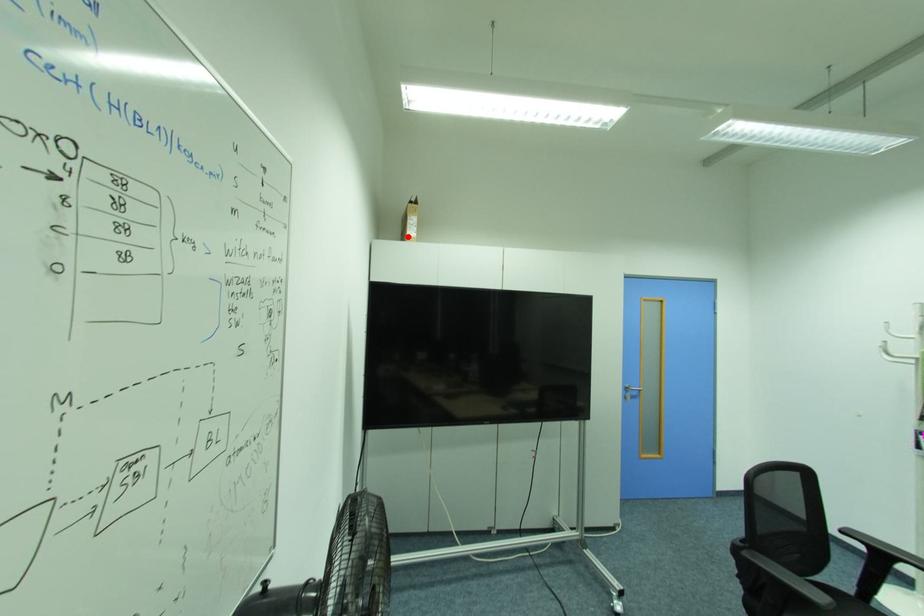
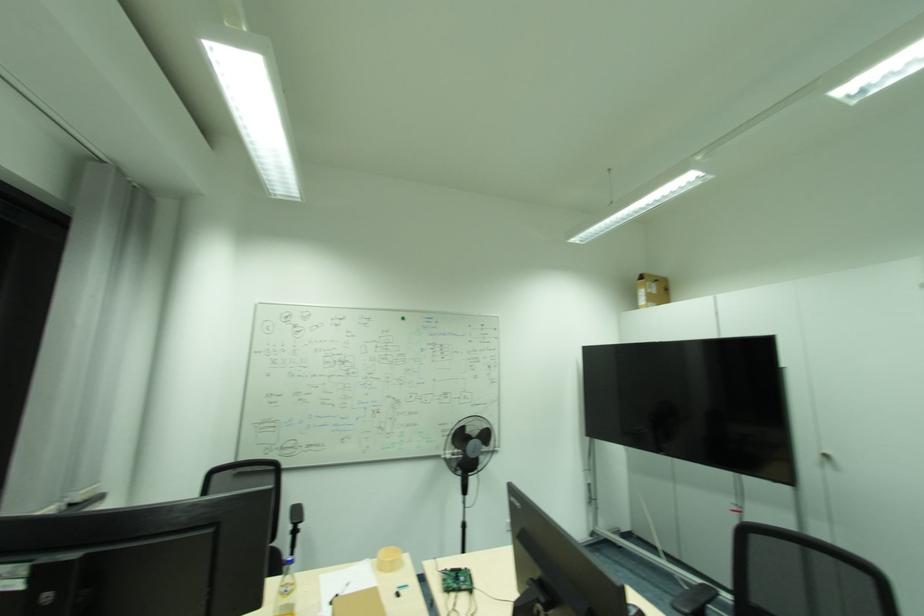
Locate, in the second image, the point that corresponds to the highlighted location in the first image.

(639, 307)